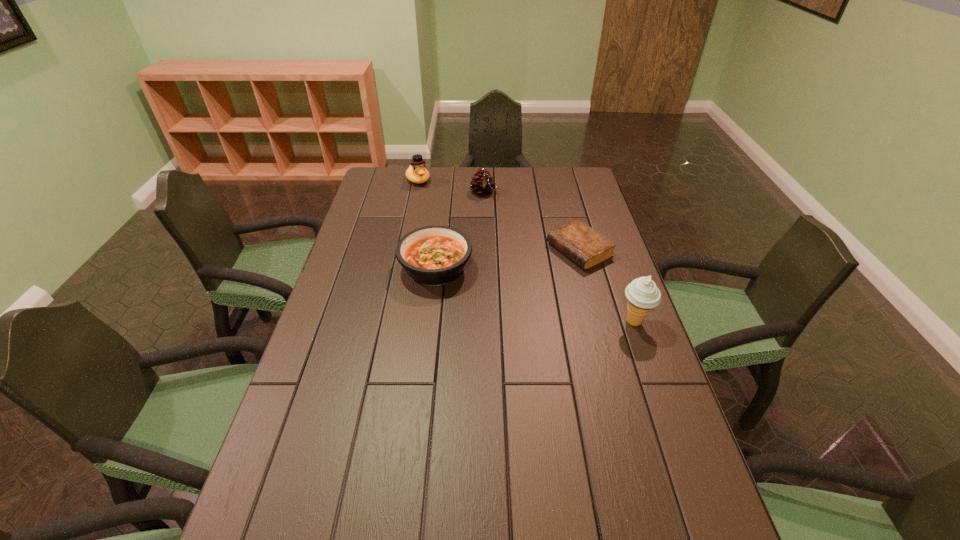
Identify the location of free space on the desktop that is between the fourth tallest object and the icecream and is positioned with a leaf charm attached to the pinecone. (545, 298).

The height and width of the screenshot is (540, 960). What are the coordinates of `free space on the desktop that is between the second shortest object and the nearest object and is positioned on the spine side of the shortest object` in the screenshot? It's located at (503, 286).

Image resolution: width=960 pixels, height=540 pixels. Identify the location of free space on the desktop that is between the second shortest object and the nearest object and is positioned on the front-facing side of the duck. (502, 286).